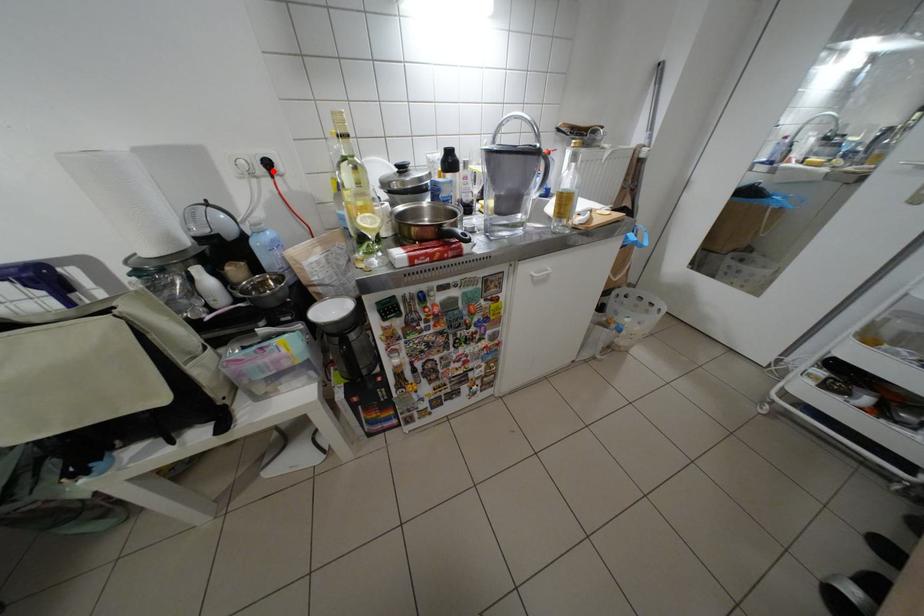
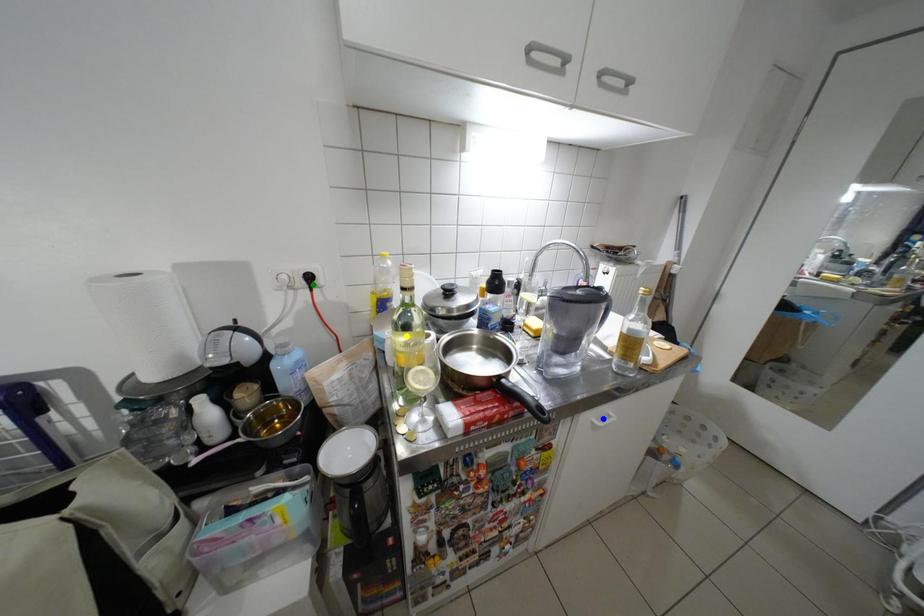
Question: I am providing you with two images of the same scene from different viewpoints. A red point is marked on the first image. You are given multiple points on the second image. Can you choose the point in image 2 that corresponds to the point in image 1?

Choices:
 (A) yellow point
 (B) green point
 (C) blue point

Answer: (B)